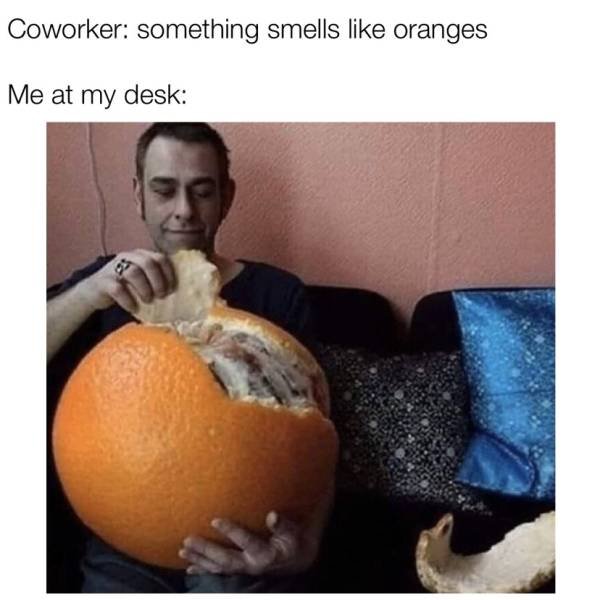
I want to click on blue pillow, so click(x=520, y=406).